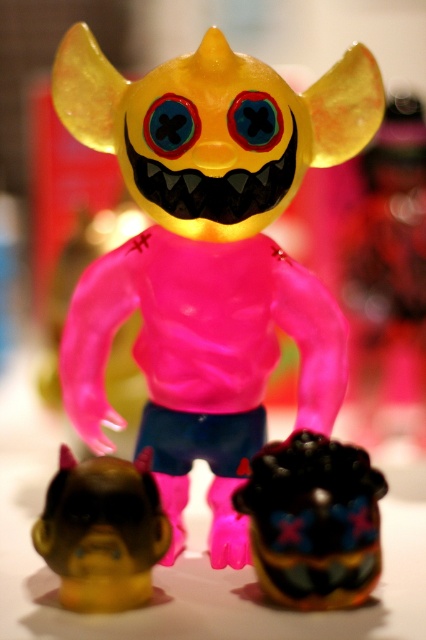
You are a collector who wants to place the matte black toy head at lower center and the brown matte head at lower left on a shelf. Which head should you place first to ensure the one closer to the viewer is in front?

You should place the matte black toy head at lower center first since it is closer to the viewer than the brown matte head at lower left, so it should be positioned in front to maintain the correct perspective.

You are a child looking at the toy display. You see the matte black toy head at lower center and the brown matte head at lower left. Which one is positioned to the right side?

The matte black toy head at lower center is positioned to the right of the brown matte head at lower left.

From the picture: You are positioning a camera to capture the translucent yellow toy at center. What are the coordinates where you should aim the camera to ensure the toy is centered in the frame?

The translucent yellow toy at center is located at point coordinates (x=207, y=257), so you should aim the camera at those coordinates to center the toy in the frame.